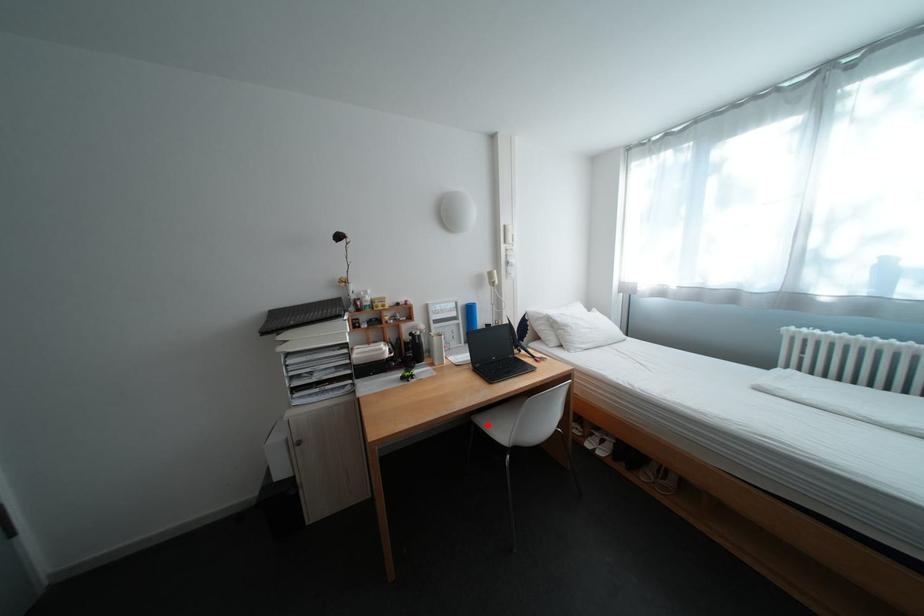
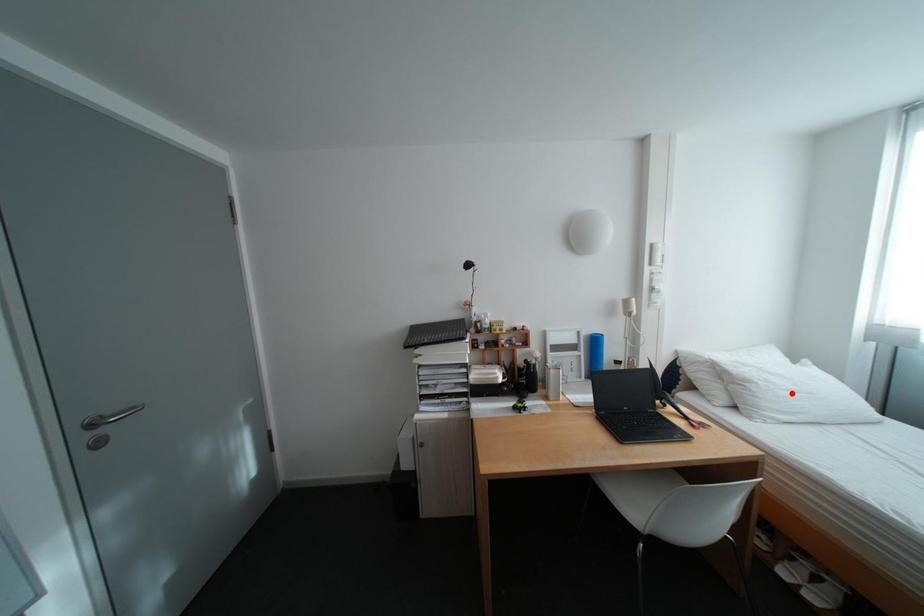
I am providing you with two images of the same scene from different viewpoints. A red point is marked on the first image and another point is marked on the second image. Is the marked point in image1 the same physical position as the marked point in image2?

No